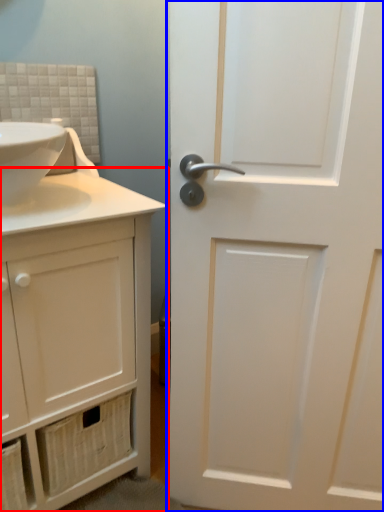
Question: Which of the following is the farthest to the observer, bathroom cabinet (highlighted by a red box) or door (highlighted by a blue box)?

Choices:
 (A) bathroom cabinet
 (B) door

Answer: (A)